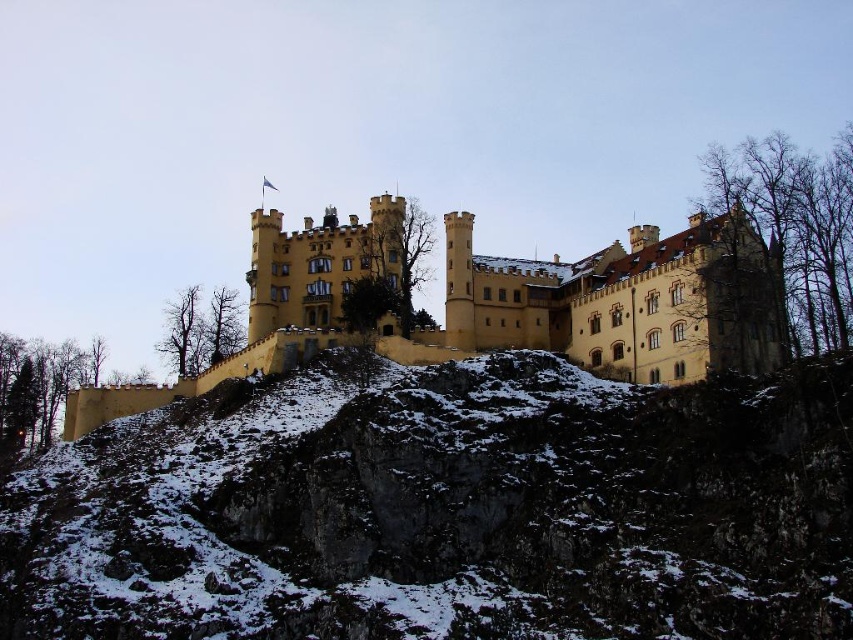
What do you see at coordinates (447, 512) in the screenshot? The height and width of the screenshot is (640, 853). I see `yellow stone wall at center` at bounding box center [447, 512].

Where is `yellow stone wall at center`? The image size is (853, 640). yellow stone wall at center is located at coordinates pos(447,512).